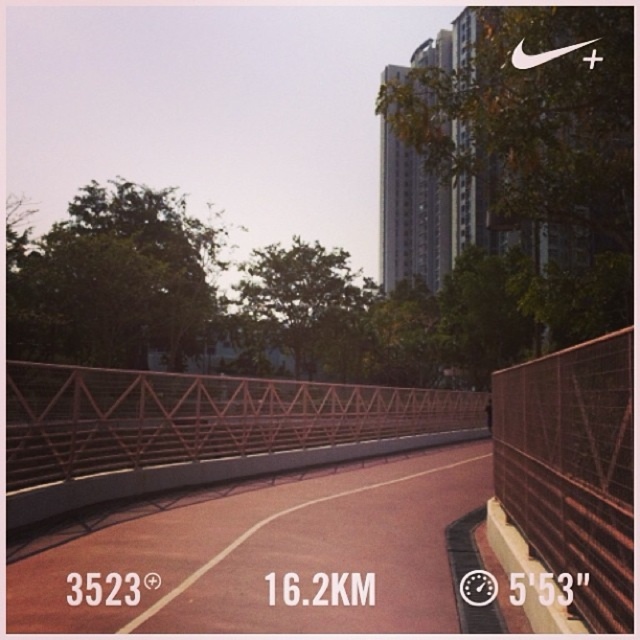
You are a city planner evaluating the space between the metallic pink pedestrian bridge at center and the rustic metal fence at right for installing a new bench. Based on their sizes, can you determine which one has more space available next to it for the bench?

The metallic pink pedestrian bridge at center has a larger width than the rustic metal fence at right, so there is more space available next to it for installing the bench.

You are a maintenance worker needing to inspect both the metallic pink pedestrian bridge at center and the rustic metal fence at right. If your ladder is 6 meters long, can you safely place it between them to reach both structures without moving the ladder?

The distance between the metallic pink pedestrian bridge at center and the rustic metal fence at right is 6.20 meters. Since the ladder is only 6 meters long, it would be 20 centimeters too short to span the gap between them. Therefore, you cannot safely place the ladder between them to reach both structures without moving it.

You are a city planner evaluating the running track area. You need to determine if the metallic pink pedestrian bridge at center can accommodate a temporary art installation that requires more space than the rustic metal fence at right. Based on their sizes, can the installation be placed on the bridge?

The metallic pink pedestrian bridge at center has a larger size compared to rustic metal fence at right, so yes, the temporary art installation requiring more space than the rustic metal fence at right can be placed on the bridge since it has sufficient space.